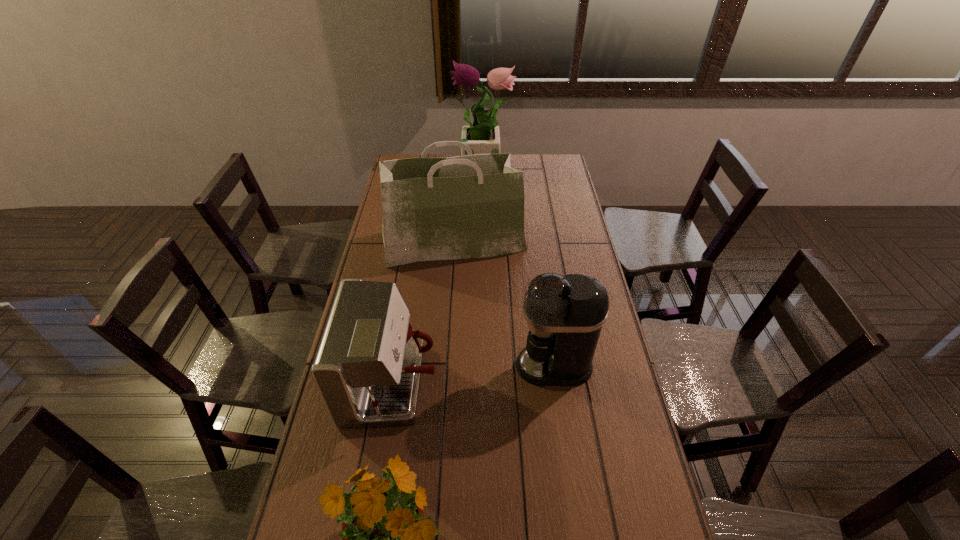
Identify the location of free space between the farthest object and the right coffee maker. The width and height of the screenshot is (960, 540). (518, 268).

This screenshot has width=960, height=540. Identify the location of the third closest object to the second farthest object. (565, 315).

Image resolution: width=960 pixels, height=540 pixels. In order to click on object that stands as the second closest to the flower arrangement in this screenshot , I will do `click(367, 369)`.